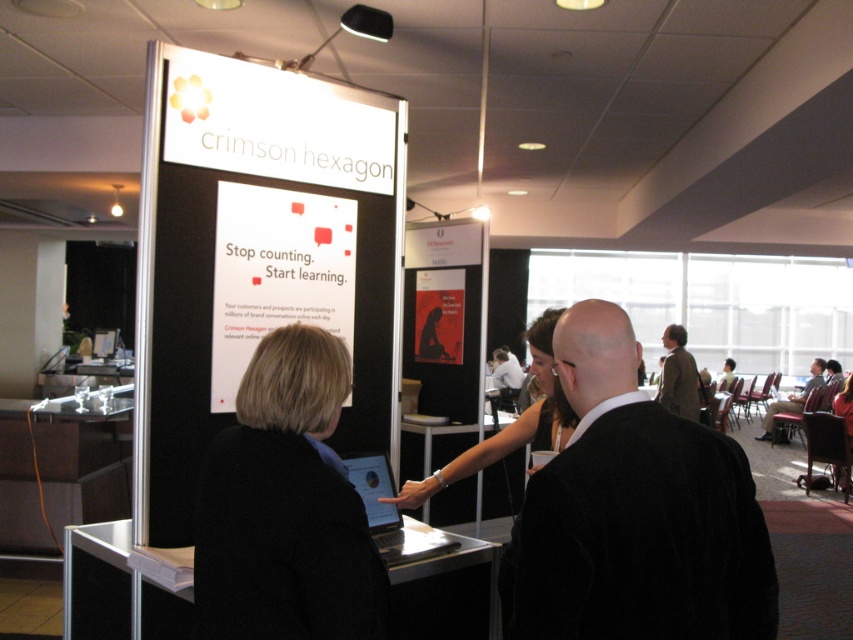
You are standing in the conference room and want to hand your matte black jacket at center to someone behind the silver metallic laptop at center. Can you reach them without moving from your current position?

The silver metallic laptop at center is 19.53 feet away from the matte black jacket at center. Since this distance is quite large, you would not be able to reach the person behind the laptop without moving closer.

You are attending a conference and see the promotional display for Crimson Hexagon. You notice a light brown leather jacket at right and a dark brown leather chair at right. Which object is closer to the left side of the display?

The light brown leather jacket at right is positioned on the left side of the dark brown leather chair at right, so it is closer to the left side of the display.